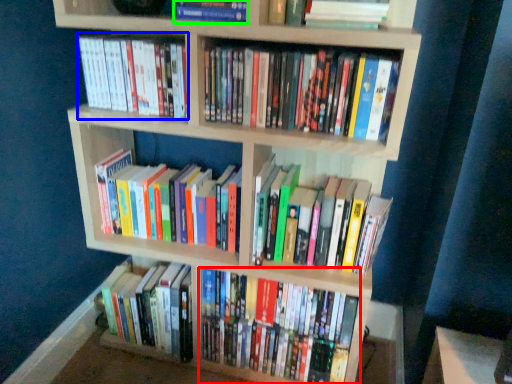
Question: Which object is positioned closest to book (highlighted by a red box)? Select from book (highlighted by a blue box) and book (highlighted by a green box).

Choices:
 (A) book
 (B) book

Answer: (A)